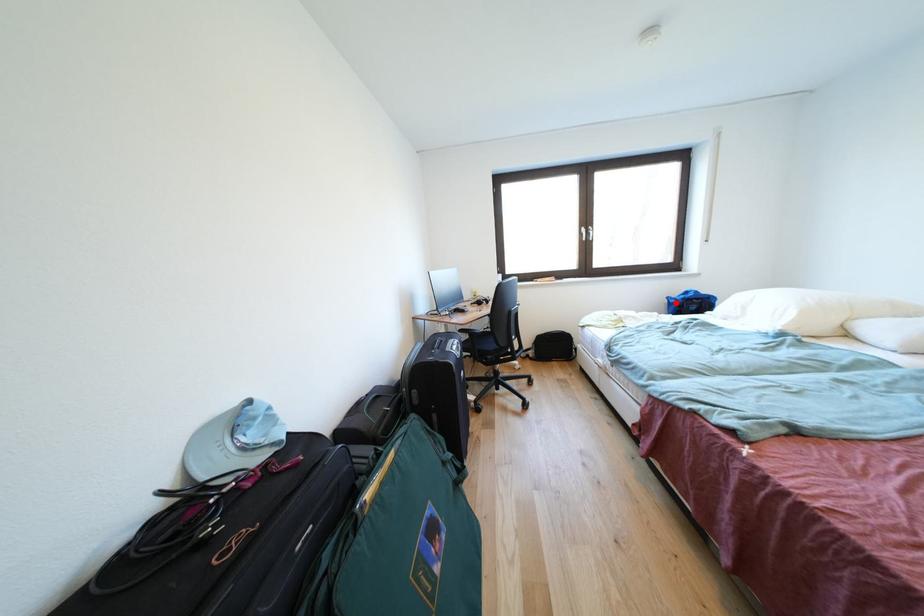
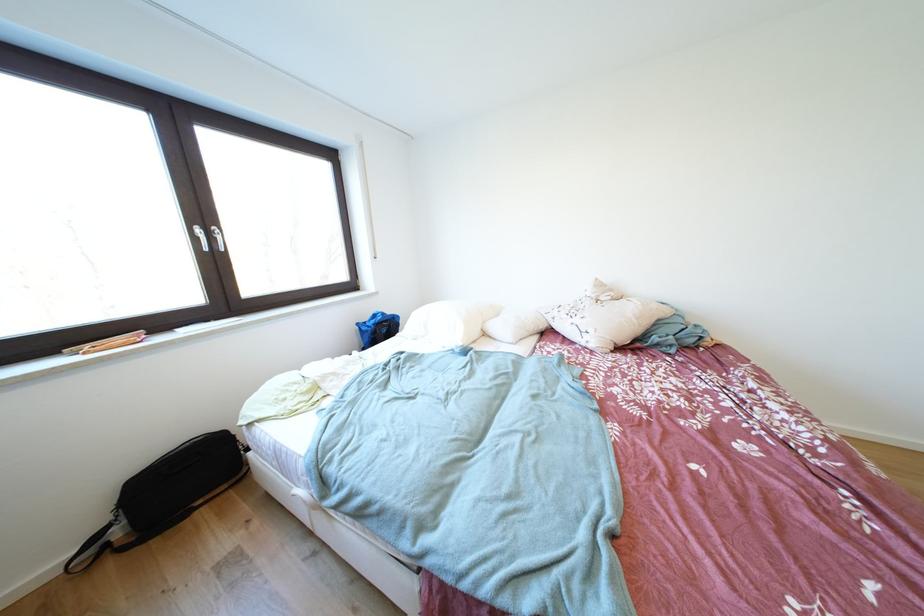
Where in the second image is the point corresponding to the highlighted location from the first image?

(367, 329)